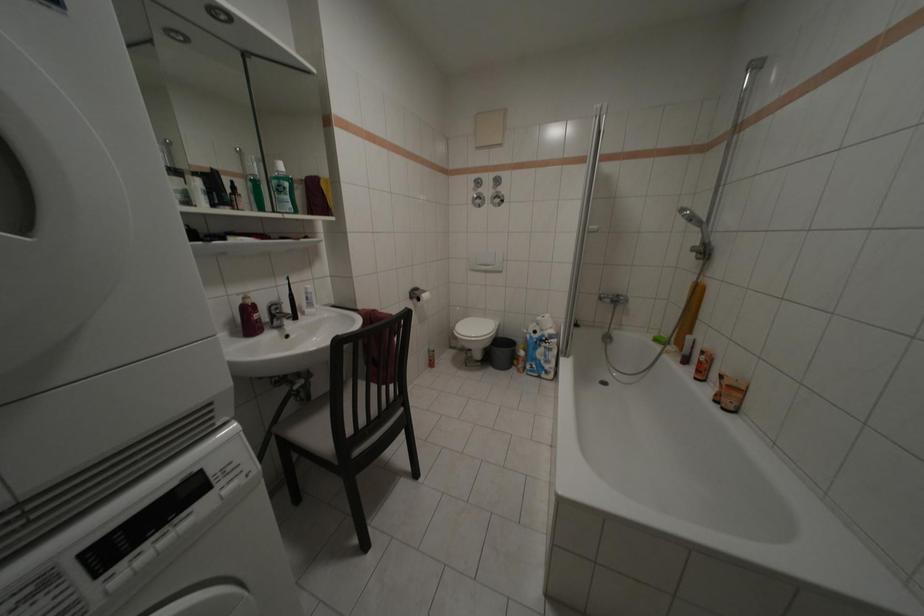
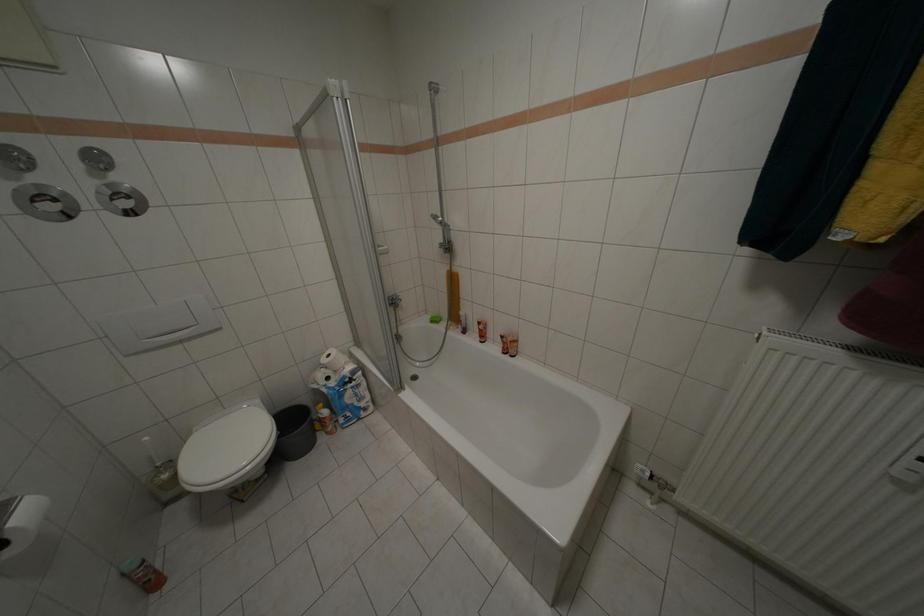
First-person continuous shooting, in which direction is the camera rotating?

The camera rotated toward right-down.